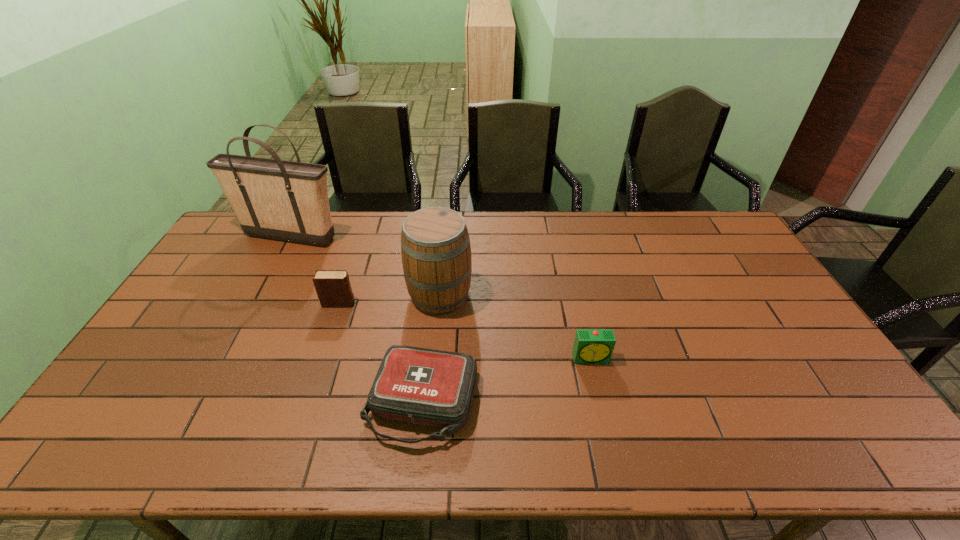
Locate an element on the screen. vacant region at the near right corner of the desktop is located at coordinates (852, 457).

At what (x,y) coordinates should I click in order to perform the action: click on vacant space in between the cider and the diary. Please return your answer as a coordinate pair (x, y). Looking at the image, I should click on coord(390,299).

Locate an element on the screen. The image size is (960, 540). vacant space that is in between the cider and the tallest object is located at coordinates (366, 266).

At what (x,y) coordinates should I click in order to perform the action: click on free space between the shopping bag and the fourth shortest object. Please return your answer as a coordinate pair (x, y). Looking at the image, I should click on (366, 266).

Locate an element on the screen. Image resolution: width=960 pixels, height=540 pixels. free spot between the diary and the cider is located at coordinates (390, 299).

Identify the location of vacant space that's between the third shortest object and the first-aid kit. (380, 353).

The width and height of the screenshot is (960, 540). I want to click on free space between the first-aid kit and the fourth object from right to left, so click(380, 353).

You are a GUI agent. You are given a task and a screenshot of the screen. Output one action in this format:
    pyautogui.click(x=<x>, y=<y>)
    Task: Click on the unoccupied area between the first-aid kit and the cider
    The height and width of the screenshot is (540, 960).
    Given the screenshot: What is the action you would take?
    pyautogui.click(x=431, y=349)

Find the location of a particular element. This screenshot has width=960, height=540. vacant point located between the second object from left to right and the farthest object is located at coordinates (315, 270).

I want to click on vacant region between the diary and the alarm clock, so click(x=466, y=330).